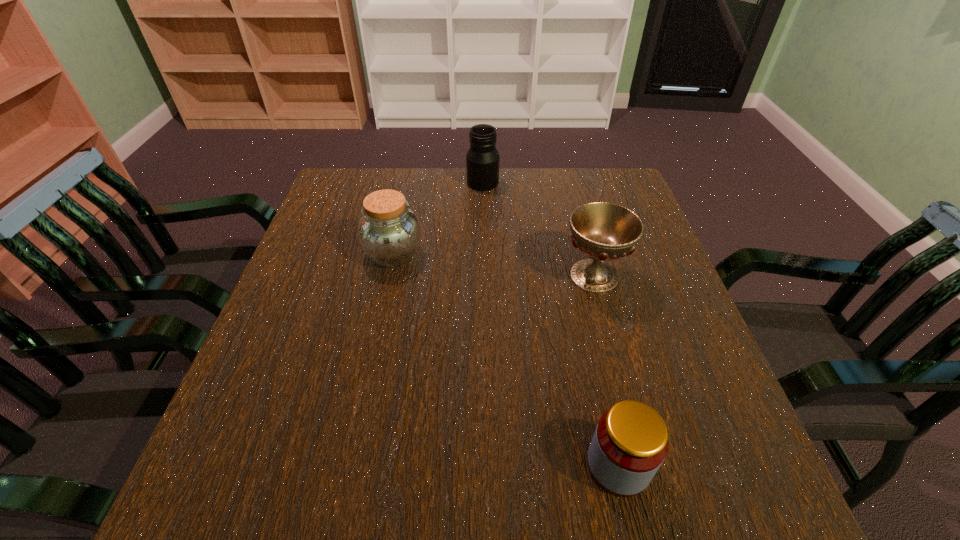
You are a GUI agent. You are given a task and a screenshot of the screen. Output one action in this format:
    pyautogui.click(x=<x>, y=<y>)
    Task: Click on the object that is the closest to the shortest object
    
    Given the screenshot: What is the action you would take?
    pyautogui.click(x=603, y=231)

Find the location of a particular element. This screenshot has height=540, width=960. object identified as the closest to the chalice is located at coordinates (482, 159).

Choose which jar is the nearest neighbor to the third object from right to left. Please provide its 2D coordinates. Your answer should be formatted as a tuple, i.e. [(x, y)], where the tuple contains the x and y coordinates of a point satisfying the conditions above.

[(389, 232)]

Locate an element on the screen. Image resolution: width=960 pixels, height=540 pixels. the second closest jar to the second jar from left to right is located at coordinates (630, 443).

Locate an element on the screen. This screenshot has height=540, width=960. free space that satisfies the following two spatial constraints: 1. on the front side of the shortest object; 2. on the right side of the leftmost object is located at coordinates (348, 465).